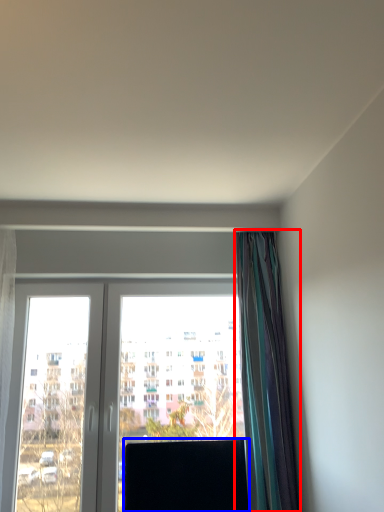
Question: Among these objects, which one is farthest to the camera, curtain (highlighted by a red box) or window screen (highlighted by a blue box)?

Choices:
 (A) curtain
 (B) window screen

Answer: (B)